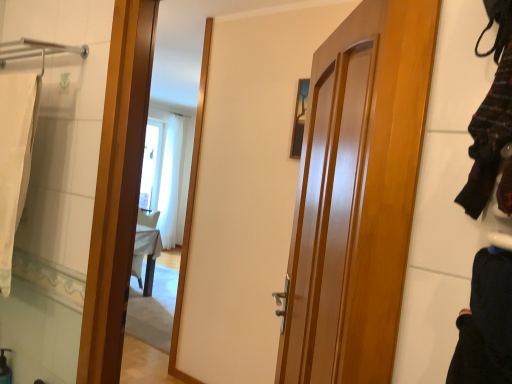
Locate an element on the screen. The height and width of the screenshot is (384, 512). glossy wood door at center is located at coordinates (357, 194).

Visually, is white fabric bath towel at left positioned to the left or to the right of glossy wood door at center?

From the image, it's evident that white fabric bath towel at left is to the left of glossy wood door at center.

You are a GUI agent. You are given a task and a screenshot of the screen. Output one action in this format:
    pyautogui.click(x=<x>, y=<y>)
    Task: Click on the door lying below the white fabric bath towel at left (from the image's perspective)
    The image size is (512, 384).
    Given the screenshot: What is the action you would take?
    pyautogui.click(x=357, y=194)

Is white fabric bath towel at left wider or thinner than glossy wood door at center?

In the image, white fabric bath towel at left appears to be wider than glossy wood door at center.

Is white fabric bath towel at left placed right next to glossy wood door at center?

No, white fabric bath towel at left is not next to glossy wood door at center.

Considering the sizes of objects glossy wood door at center and white fabric bath towel at left in the image provided, who is bigger, glossy wood door at center or white fabric bath towel at left?

With larger size is glossy wood door at center.

Is glossy wood door at center with white fabric bath towel at left?

No, glossy wood door at center is not beside white fabric bath towel at left.

Is glossy wood door at center positioned in front of white fabric bath towel at left?

Yes, it is in front of white fabric bath towel at left.

Does point (336, 213) come in front of point (16, 126)?

Yes.

Which object is wider, black cotton pants at lower right, arranged as the second clothing when viewed from the top, or glossy wood door at center?

black cotton pants at lower right, arranged as the second clothing when viewed from the top.

From the picture: Which object is further away from the camera taking this photo, black cotton pants at lower right, arranged as the second clothing when viewed from the top, or glossy wood door at center?

Positioned behind is glossy wood door at center.

Does point (511, 377) come behind point (277, 375)?

No, it is in front of (277, 375).

Between black cotton pants at lower right, the 1th clothing ordered from the bottom, and glossy wood door at center, which one has less height?

black cotton pants at lower right, the 1th clothing ordered from the bottom, is shorter.

Which is in front, striped wool sweater at right, the first clothing positioned from the top, or white fabric bath towel at left?

Positioned in front is striped wool sweater at right, the first clothing positioned from the top.

Considering the positions of points (479, 160) and (0, 148), is point (479, 160) farther from camera compared to point (0, 148)?

That is False.

Which of these two, striped wool sweater at right, the first clothing positioned from the top, or white fabric bath towel at left, is thinner?

striped wool sweater at right, the first clothing positioned from the top, is thinner.

Which object is wider, black cotton pants at lower right, arranged as the second clothing when viewed from the top, or striped wool sweater at right, the 2th clothing positioned from the bottom?

Wider between the two is black cotton pants at lower right, arranged as the second clothing when viewed from the top.

Is black cotton pants at lower right, the 1th clothing ordered from the bottom, touching striped wool sweater at right, the 2th clothing positioned from the bottom?

black cotton pants at lower right, the 1th clothing ordered from the bottom, and striped wool sweater at right, the 2th clothing positioned from the bottom, are clearly separated.

Is black cotton pants at lower right, arranged as the second clothing when viewed from the top, bigger or smaller than striped wool sweater at right, the first clothing positioned from the top?

black cotton pants at lower right, arranged as the second clothing when viewed from the top, is bigger than striped wool sweater at right, the first clothing positioned from the top.

Can striped wool sweater at right, the first clothing positioned from the top, be found inside black cotton pants at lower right, the 1th clothing ordered from the bottom?

No.

Is white fabric bath towel at left to the left of striped wool sweater at right, the first clothing positioned from the top, from the viewer's perspective?

Correct, you'll find white fabric bath towel at left to the left of striped wool sweater at right, the first clothing positioned from the top.

Based on the photo, considering the relative sizes of white fabric bath towel at left and striped wool sweater at right, the 2th clothing positioned from the bottom, in the image provided, is white fabric bath towel at left smaller than striped wool sweater at right, the 2th clothing positioned from the bottom,?

No.

Is white fabric bath towel at left not near striped wool sweater at right, the 2th clothing positioned from the bottom?

Absolutely, white fabric bath towel at left is distant from striped wool sweater at right, the 2th clothing positioned from the bottom.

Based on the photo, is black cotton pants at lower right, the 1th clothing ordered from the bottom, bigger or smaller than white fabric bath towel at left?

In the image, black cotton pants at lower right, the 1th clothing ordered from the bottom, appears to be smaller than white fabric bath towel at left.

Which object is wider, black cotton pants at lower right, arranged as the second clothing when viewed from the top, or white fabric bath towel at left?

Wider between the two is white fabric bath towel at left.

Considering the relative positions of black cotton pants at lower right, the 1th clothing ordered from the bottom, and white fabric bath towel at left in the image provided, is black cotton pants at lower right, the 1th clothing ordered from the bottom, to the right of white fabric bath towel at left from the viewer's perspective?

Yes.

Is black cotton pants at lower right, the 1th clothing ordered from the bottom, inside or outside of white fabric bath towel at left?

black cotton pants at lower right, the 1th clothing ordered from the bottom, is not enclosed by white fabric bath towel at left.

I want to click on door below the white fabric bath towel at left (from a real-world perspective), so click(357, 194).

Identify the location of door lying below the white fabric bath towel at left (from the image's perspective). (357, 194).

When comparing their distances from striped wool sweater at right, the 2th clothing positioned from the bottom, does black cotton pants at lower right, arranged as the second clothing when viewed from the top, or glossy wood door at center seem further?

glossy wood door at center is positioned further to the anchor striped wool sweater at right, the 2th clothing positioned from the bottom.

When comparing their distances from black cotton pants at lower right, arranged as the second clothing when viewed from the top, does white fabric bath towel at left or striped wool sweater at right, the 2th clothing positioned from the bottom, seem closer?

striped wool sweater at right, the 2th clothing positioned from the bottom, is positioned closer to the anchor black cotton pants at lower right, arranged as the second clothing when viewed from the top.

Which object lies further to the anchor point glossy wood door at center, white fabric bath towel at left or black cotton pants at lower right, the 1th clothing ordered from the bottom?

Among the two, white fabric bath towel at left is located further to glossy wood door at center.

Looking at this image, based on their spatial positions, is black cotton pants at lower right, arranged as the second clothing when viewed from the top, or white fabric bath towel at left closer to striped wool sweater at right, the first clothing positioned from the top?

Based on the image, black cotton pants at lower right, arranged as the second clothing when viewed from the top, appears to be nearer to striped wool sweater at right, the first clothing positioned from the top.

When comparing their distances from white fabric bath towel at left, does black cotton pants at lower right, arranged as the second clothing when viewed from the top, or glossy wood door at center seem further?

The object further to white fabric bath towel at left is black cotton pants at lower right, arranged as the second clothing when viewed from the top.

Which object lies further to the anchor point glossy wood door at center, white fabric bath towel at left or striped wool sweater at right, the 2th clothing positioned from the bottom?

Based on the image, white fabric bath towel at left appears to be further to glossy wood door at center.

Estimate the real-world distances between objects in this image. Which object is closer to glossy wood door at center, striped wool sweater at right, the 2th clothing positioned from the bottom, or black cotton pants at lower right, the 1th clothing ordered from the bottom?

striped wool sweater at right, the 2th clothing positioned from the bottom, is positioned closer to the anchor glossy wood door at center.

Which object lies nearer to the anchor point black cotton pants at lower right, the 1th clothing ordered from the bottom, striped wool sweater at right, the first clothing positioned from the top, or glossy wood door at center?

striped wool sweater at right, the first clothing positioned from the top, is positioned closer to the anchor black cotton pants at lower right, the 1th clothing ordered from the bottom.

Where is `door between white fabric bath towel at left and striped wool sweater at right, the first clothing positioned from the top, from left to right`? This screenshot has height=384, width=512. door between white fabric bath towel at left and striped wool sweater at right, the first clothing positioned from the top, from left to right is located at coordinates (357, 194).

Where is `clothing between black cotton pants at lower right, the 1th clothing ordered from the bottom, and glossy wood door at center in the front-back direction`? The width and height of the screenshot is (512, 384). clothing between black cotton pants at lower right, the 1th clothing ordered from the bottom, and glossy wood door at center in the front-back direction is located at coordinates (489, 138).

This screenshot has width=512, height=384. What are the coordinates of `clothing between white fabric bath towel at left and black cotton pants at lower right, the 1th clothing ordered from the bottom, from left to right` in the screenshot? It's located at (489, 138).

Where is `door located between white fabric bath towel at left and black cotton pants at lower right, arranged as the second clothing when viewed from the top, in the left-right direction`? Image resolution: width=512 pixels, height=384 pixels. door located between white fabric bath towel at left and black cotton pants at lower right, arranged as the second clothing when viewed from the top, in the left-right direction is located at coordinates (357, 194).